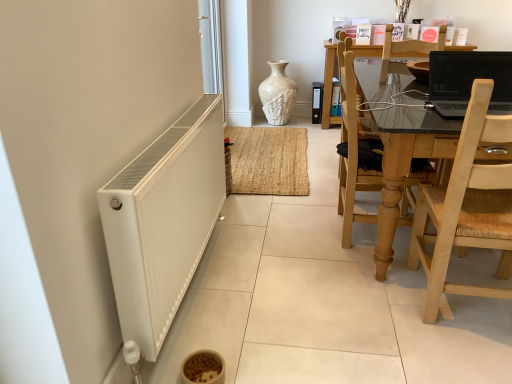
Question: From the image's perspective, relative to white glossy screen door at upper left, is wooden chair at right, positioned as the first chair in back-to-front order, above or below?

Choices:
 (A) below
 (B) above

Answer: (A)

Question: From a real-world perspective, is wooden chair at right, positioned as the first chair in back-to-front order, physically located above or below white glossy screen door at upper left?

Choices:
 (A) below
 (B) above

Answer: (A)

Question: Which object is the closest to the wooden chair at right, positioned as the first chair in back-to-front order?

Choices:
 (A) black glossy laptop at upper right
 (B) white matte radiator at lower left
 (C) light wood woven seat at right, which appears as the first chair when viewed from the front
 (D) white textured file cabinet at center
 (E) white textured vase at center

Answer: (A)

Question: Considering the real-world distances, which object is closest to the light wood woven seat at right, the second chair in the back-to-front sequence?

Choices:
 (A) black glossy laptop at upper right
 (B) white textured vase at center
 (C) wooden chair at right, positioned as the first chair in back-to-front order
 (D) white textured file cabinet at center
 (E) white matte radiator at lower left

Answer: (A)